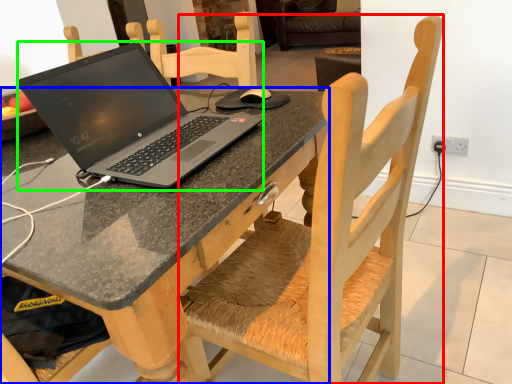
Question: Which object is the farthest from chair (highlighted by a red box)? Choose among these: desk (highlighted by a blue box) or laptop (highlighted by a green box).

Choices:
 (A) desk
 (B) laptop

Answer: (B)